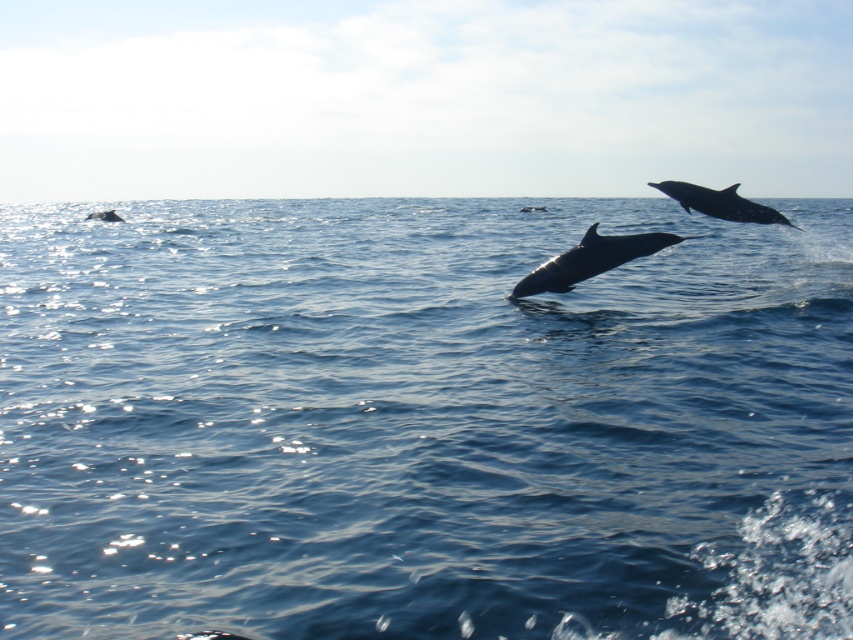
You are a marine biologist observing the ocean scene. You notice the smooth gray dolphin at upper right and the gray matte whale at lower left. Which of these two marine animals is located closer to the horizon?

The smooth gray dolphin at upper right is positioned under the gray matte whale at lower left, so the gray matte whale at lower left is closer to the horizon.

You are a marine biologist observing the ocean scene. You notice a silvery skin dolphin at center. Can you determine its exact position in the image using coordinates?

The silvery skin dolphin at center is located at point [590,259].